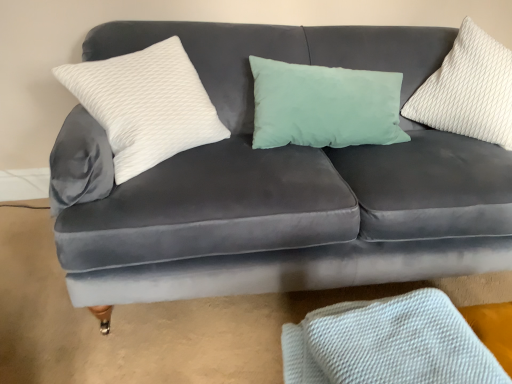
Question: From the image's perspective, is white textured pillow at left, the 2th pillow positioned from the right, on top of white textured pillow at upper right, the second pillow from the left?

Choices:
 (A) yes
 (B) no

Answer: (B)

Question: Can you confirm if white textured pillow at left, the 1th pillow positioned from the left, is positioned to the left of white textured pillow at upper right, the second pillow from the left?

Choices:
 (A) yes
 (B) no

Answer: (A)

Question: Would you say white textured pillow at left, the 1th pillow positioned from the left, contains white textured pillow at upper right, the first pillow from the right?

Choices:
 (A) no
 (B) yes

Answer: (A)

Question: Can you confirm if white textured pillow at left, the 1th pillow positioned from the left, is shorter than white textured pillow at upper right, the first pillow from the right?

Choices:
 (A) no
 (B) yes

Answer: (B)

Question: Is white textured pillow at left, the 2th pillow positioned from the right, in contact with white textured pillow at upper right, the first pillow from the right?

Choices:
 (A) no
 (B) yes

Answer: (A)

Question: From their relative heights in the image, would you say white textured pillow at left, the 1th pillow positioned from the left, is taller or shorter than white textured fabric at lower right?

Choices:
 (A) short
 (B) tall

Answer: (B)

Question: From the image's perspective, relative to white textured fabric at lower right, is white textured pillow at left, the 2th pillow positioned from the right, above or below?

Choices:
 (A) above
 (B) below

Answer: (A)

Question: Is white textured pillow at left, the 2th pillow positioned from the right, in front of or behind white textured fabric at lower right in the image?

Choices:
 (A) front
 (B) behind

Answer: (B)

Question: Considering the positions of white textured pillow at left, the 1th pillow positioned from the left, and white textured fabric at lower right in the image, is white textured pillow at left, the 1th pillow positioned from the left, bigger or smaller than white textured fabric at lower right?

Choices:
 (A) small
 (B) big

Answer: (B)

Question: From the image's perspective, is white textured pillow at left, the 1th pillow positioned from the left, located above or below white textured pillow at upper right, the first pillow from the right?

Choices:
 (A) below
 (B) above

Answer: (A)

Question: Visually, is white textured pillow at left, the 1th pillow positioned from the left, positioned to the left or to the right of white textured pillow at upper right, the second pillow from the left?

Choices:
 (A) right
 (B) left

Answer: (B)

Question: Is white textured pillow at left, the 2th pillow positioned from the right, wider or thinner than white textured pillow at upper right, the second pillow from the left?

Choices:
 (A) thin
 (B) wide

Answer: (B)

Question: Which is correct: white textured pillow at left, the 2th pillow positioned from the right, is inside white textured pillow at upper right, the first pillow from the right, or outside of it?

Choices:
 (A) outside
 (B) inside

Answer: (A)

Question: In terms of width, does white textured pillow at upper right, the first pillow from the right, look wider or thinner when compared to white textured fabric at lower right?

Choices:
 (A) thin
 (B) wide

Answer: (A)

Question: From the image's perspective, is white textured pillow at upper right, the first pillow from the right, above or below white textured fabric at lower right?

Choices:
 (A) above
 (B) below

Answer: (A)